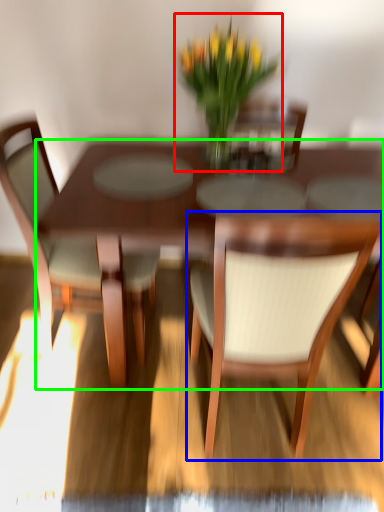
Question: Estimate the real-world distances between objects in this image. Which object is closer to houseplant (highlighted by a red box), chair (highlighted by a blue box) or kitchen & dining room table (highlighted by a green box)?

Choices:
 (A) chair
 (B) kitchen & dining room table

Answer: (B)